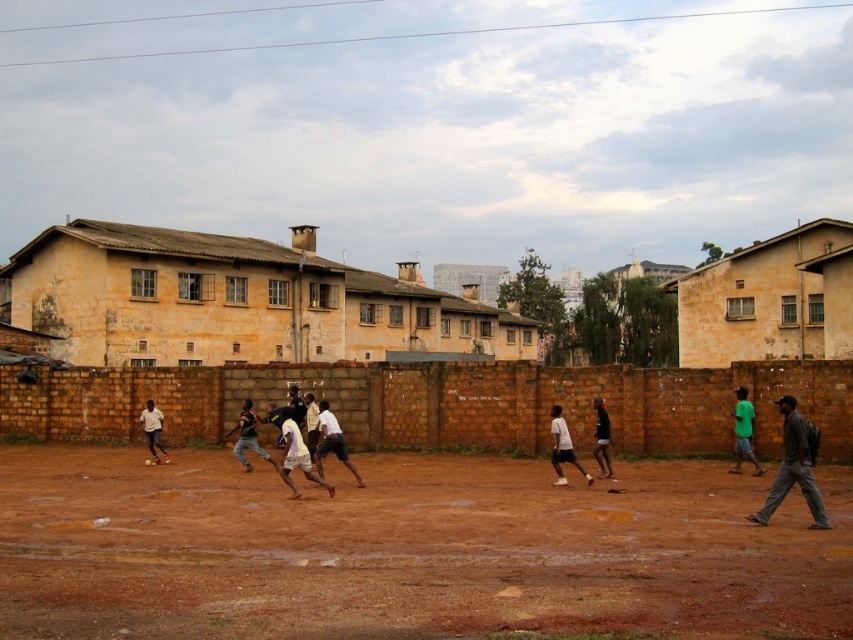
Which is in front, point (801, 417) or point (569, 444)?

Point (801, 417)

Locate an element on the screen. This screenshot has height=640, width=853. dark gray fabric backpack at lower right is located at coordinates (795, 467).

Between brown dirt field at center and white matte shirt at center, which one is positioned lower?

Positioned lower is brown dirt field at center.

Can you confirm if brown dirt field at center is bigger than white matte shirt at center?

Yes, brown dirt field at center is bigger than white matte shirt at center.

Find the location of a particular element. This screenshot has width=853, height=640. brown dirt field at center is located at coordinates (405, 550).

Which is below, brown dirt field at center or dark gray fabric backpack at lower right?

brown dirt field at center

At what (x,y) coordinates should I click in order to perform the action: click on brown dirt field at center. Please return your answer as a coordinate pair (x, y). Image resolution: width=853 pixels, height=640 pixels. Looking at the image, I should click on (405, 550).

Does point (1, 568) come behind point (817, 490)?

No, (1, 568) is in front of (817, 490).

Find the location of `brown dirt field at center`. brown dirt field at center is located at coordinates (405, 550).